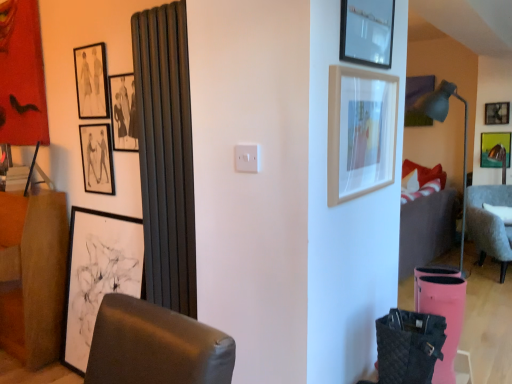
Question: Is matte black picture frame at upper center, the 7th picture frame viewed from the back, shorter than matte black picture frame at upper left, positioned as the 7th picture frame in right-to-left order?

Choices:
 (A) no
 (B) yes

Answer: (B)

Question: From the image's perspective, is matte black picture frame at upper center, the sixth picture frame when ordered from left to right, located above matte black picture frame at upper left, which ranks as the 2th picture frame in left-to-right order?

Choices:
 (A) no
 (B) yes

Answer: (B)

Question: Can you confirm if matte black picture frame at upper center, which ranks as the 2th picture frame in front-to-back order, is thinner than matte black picture frame at upper left, which ranks as the third picture frame in back-to-front order?

Choices:
 (A) no
 (B) yes

Answer: (A)

Question: Is matte black picture frame at upper center, which is the 3th picture frame from right to left, to the left of matte black picture frame at upper left, which ranks as the third picture frame in back-to-front order, from the viewer's perspective?

Choices:
 (A) no
 (B) yes

Answer: (A)

Question: Does matte black picture frame at upper center, the sixth picture frame when ordered from left to right, appear on the right side of matte black picture frame at upper left, which ranks as the 6th picture frame in front-to-back order?

Choices:
 (A) yes
 (B) no

Answer: (A)

Question: From the image's perspective, is matte black picture frame at upper left, which ranks as the 2th picture frame in left-to-right order, located above or below matte black picture frame at upper left, the 4th picture frame positioned from the front?

Choices:
 (A) below
 (B) above

Answer: (A)

Question: From a real-world perspective, is matte black picture frame at upper left, which ranks as the 6th picture frame in front-to-back order, physically located above or below matte black picture frame at upper left, the 4th picture frame positioned from the front?

Choices:
 (A) below
 (B) above

Answer: (A)

Question: In terms of width, does matte black picture frame at upper left, which ranks as the third picture frame in back-to-front order, look wider or thinner when compared to matte black picture frame at upper left, the 4th picture frame positioned from the front?

Choices:
 (A) wide
 (B) thin

Answer: (A)

Question: Is matte black picture frame at upper left, positioned as the 7th picture frame in right-to-left order, in front of or behind matte black picture frame at upper left, the fifth picture frame in the back-to-front sequence, in the image?

Choices:
 (A) behind
 (B) front

Answer: (A)

Question: Is matte black picture frame at upper center, which ranks as the 2th picture frame in front-to-back order, inside the boundaries of matte yellow picture frame at upper right, which appears as the 1th picture frame when viewed from the right, or outside?

Choices:
 (A) outside
 (B) inside

Answer: (A)

Question: In terms of width, does matte black picture frame at upper center, the 7th picture frame viewed from the back, look wider or thinner when compared to matte yellow picture frame at upper right, which appears as the 1th picture frame when viewed from the right?

Choices:
 (A) thin
 (B) wide

Answer: (B)

Question: Considering the positions of matte black picture frame at upper center, which is the 3th picture frame from right to left, and matte yellow picture frame at upper right, the 1th picture frame positioned from the back, in the image, is matte black picture frame at upper center, which is the 3th picture frame from right to left, taller or shorter than matte yellow picture frame at upper right, the 1th picture frame positioned from the back,?

Choices:
 (A) short
 (B) tall

Answer: (A)

Question: From a real-world perspective, relative to matte yellow picture frame at upper right, the 8th picture frame from the front, is matte black picture frame at upper center, which is the 3th picture frame from right to left, vertically above or below?

Choices:
 (A) above
 (B) below

Answer: (A)

Question: Does point (96, 52) appear closer or farther from the camera than point (357, 21)?

Choices:
 (A) closer
 (B) farther

Answer: (B)

Question: In terms of width, does matte black picture frame at upper left, which is counted as the 4th picture frame, starting from the back, look wider or thinner when compared to matte black picture frame at upper center, which is the 3th picture frame from right to left?

Choices:
 (A) wide
 (B) thin

Answer: (B)